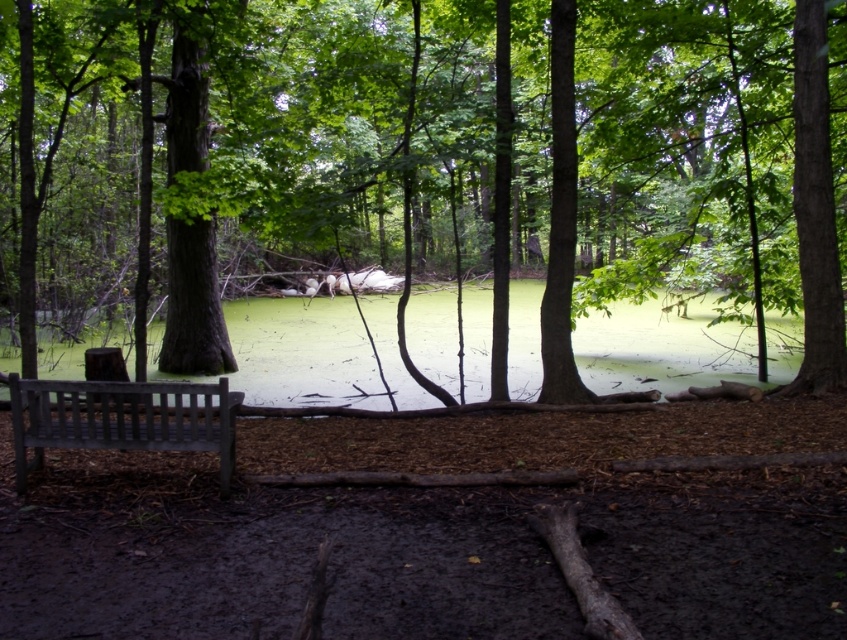
You are a hiker who wants to take a photo of the brown wood tree at center and the green algae water at center. Which object should you focus on first if you want to capture both in one frame without moving the camera?

You should focus on the brown wood tree at center first because it is to the left of the green algae water at center, so adjusting focus to the left ensures both are in the frame.

You are standing at the edge of the forest and want to reach a specific point in the scene. The point is located at coordinates point (383, 312). If you can walk 80 feet in 10 minutes, how long will it take you to reach that point?

The distance of point (383, 312) is 76.31 feet. Since you can walk 80 feet in 10 minutes, it will take approximately 9.54 minutes to reach the point.

You are a hiker who wants to take a photo of the brown wood tree at center and the green algae water at center. Since you have a camera with a fixed focal length, you need to know which one is taller. Can you tell me which object is taller?

The brown wood tree at center is much taller than the green algae water at center, so the brown wood tree at center is the taller object.